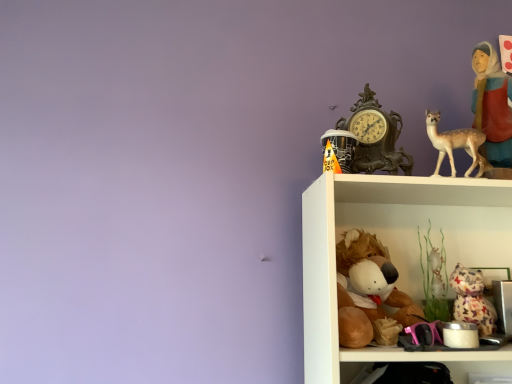
Question: Does light beige porcelain deer at upper right have a greater width compared to orange paper cone at upper right, the third toy positioned from the right?

Choices:
 (A) yes
 (B) no

Answer: (B)

Question: Is light beige porcelain deer at upper right in contact with orange paper cone at upper right, arranged as the 1th toy when viewed from the left?

Choices:
 (A) yes
 (B) no

Answer: (B)

Question: Is light beige porcelain deer at upper right not near orange paper cone at upper right, arranged as the 1th toy when viewed from the left?

Choices:
 (A) yes
 (B) no

Answer: (B)

Question: Is orange paper cone at upper right, the third toy positioned from the right, located within light beige porcelain deer at upper right?

Choices:
 (A) yes
 (B) no

Answer: (B)

Question: Considering the relative sizes of light beige porcelain deer at upper right and orange paper cone at upper right, the third toy positioned from the right, in the image provided, is light beige porcelain deer at upper right taller than orange paper cone at upper right, the third toy positioned from the right,?

Choices:
 (A) no
 (B) yes

Answer: (B)

Question: Visually, is light beige porcelain deer at upper right positioned to the left or to the right of brown plush toy at lower center, the 2th toy from the right?

Choices:
 (A) left
 (B) right

Answer: (B)

Question: From a real-world perspective, relative to brown plush toy at lower center, the 2th toy positioned from the left, is light beige porcelain deer at upper right vertically above or below?

Choices:
 (A) below
 (B) above

Answer: (B)

Question: Is light beige porcelain deer at upper right in front of or behind brown plush toy at lower center, the 2th toy from the right, in the image?

Choices:
 (A) front
 (B) behind

Answer: (B)

Question: Considering the positions of light beige porcelain deer at upper right and brown plush toy at lower center, the 2th toy from the right, in the image, is light beige porcelain deer at upper right bigger or smaller than brown plush toy at lower center, the 2th toy from the right,?

Choices:
 (A) small
 (B) big

Answer: (A)

Question: Is orange paper cone at upper right, the third toy positioned from the right, to the left or to the right of light beige porcelain deer at upper right in the image?

Choices:
 (A) right
 (B) left

Answer: (B)

Question: Is orange paper cone at upper right, arranged as the 1th toy when viewed from the left, wider or thinner than light beige porcelain deer at upper right?

Choices:
 (A) wide
 (B) thin

Answer: (A)

Question: Considering the positions of point (330, 130) and point (479, 173), is point (330, 130) closer or farther from the camera than point (479, 173)?

Choices:
 (A) farther
 (B) closer

Answer: (B)

Question: In the image, is orange paper cone at upper right, the third toy positioned from the right, positioned in front of or behind light beige porcelain deer at upper right?

Choices:
 (A) behind
 (B) front

Answer: (B)

Question: Is matte red fabric at upper right taller or shorter than antique bronze clock at upper right?

Choices:
 (A) short
 (B) tall

Answer: (B)

Question: From a real-world perspective, is matte red fabric at upper right physically located above or below antique bronze clock at upper right?

Choices:
 (A) above
 (B) below

Answer: (A)